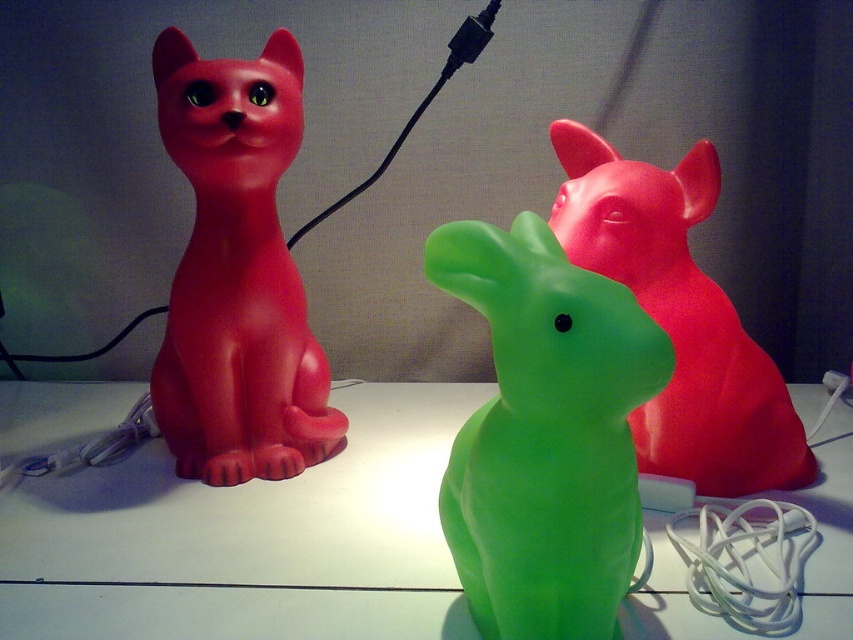
Is green translucent rabbit at center taller than matte plastic cat at left?

No.

Is point (509, 477) less distant than point (271, 268)?

Yes, point (509, 477) is in front of point (271, 268).

Locate an element on the screen. The width and height of the screenshot is (853, 640). green translucent rabbit at center is located at coordinates (546, 435).

Can you confirm if green translucent rabbit at center is taller than glossy plastic cat at upper right?

Incorrect, green translucent rabbit at center's height is not larger of glossy plastic cat at upper right's.

Image resolution: width=853 pixels, height=640 pixels. What do you see at coordinates (546, 435) in the screenshot?
I see `green translucent rabbit at center` at bounding box center [546, 435].

The image size is (853, 640). Describe the element at coordinates (546, 435) in the screenshot. I see `green translucent rabbit at center` at that location.

Locate an element on the screen. green translucent rabbit at center is located at coordinates (546, 435).

Does green translucent cat at center appear on the left side of green translucent rabbit at center?

Indeed, green translucent cat at center is positioned on the left side of green translucent rabbit at center.

Which of these two, green translucent cat at center or green translucent rabbit at center, stands shorter?

With less height is green translucent cat at center.

Which is in front, point (318, 544) or point (514, 314)?

Point (514, 314) is in front.

Image resolution: width=853 pixels, height=640 pixels. Find the location of `green translucent cat at center`. green translucent cat at center is located at coordinates (248, 540).